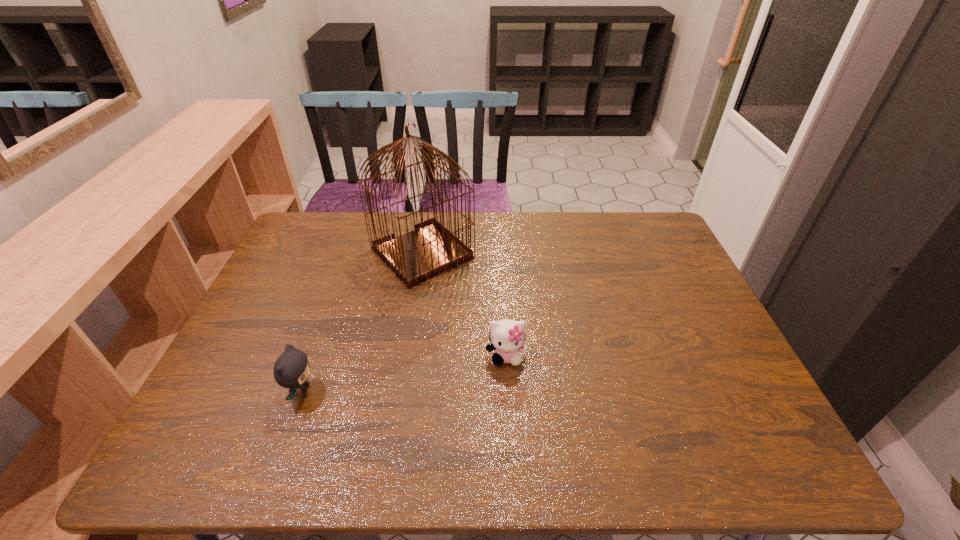
Locate an element on the screen. Image resolution: width=960 pixels, height=540 pixels. birdcage is located at coordinates (431, 249).

Image resolution: width=960 pixels, height=540 pixels. Find the location of `the second object from right to left`. the second object from right to left is located at coordinates coord(431,249).

Locate an element on the screen. This screenshot has height=540, width=960. the left kitten is located at coordinates (291, 370).

Locate an element on the screen. the right kitten is located at coordinates (507, 337).

You are a GUI agent. You are given a task and a screenshot of the screen. Output one action in this format:
    pyautogui.click(x=<x>, y=<y>)
    Task: Click on the free point located on the left of the farthest object
    
    Given the screenshot: What is the action you would take?
    pyautogui.click(x=335, y=253)

Where is `free spot located 0.110m on the front-facing side of the leftmost object`? The height and width of the screenshot is (540, 960). free spot located 0.110m on the front-facing side of the leftmost object is located at coordinates click(364, 391).

In order to click on free space located on the front-facing side of the right kitten in this screenshot , I will do `click(508, 386)`.

Find the location of a particular element. This screenshot has width=960, height=540. object that is at the far edge is located at coordinates (431, 249).

Locate an element on the screen. The image size is (960, 540). free space at the far edge of the desktop is located at coordinates (372, 232).

Locate an element on the screen. This screenshot has width=960, height=540. vacant space at the near edge of the desktop is located at coordinates (658, 454).